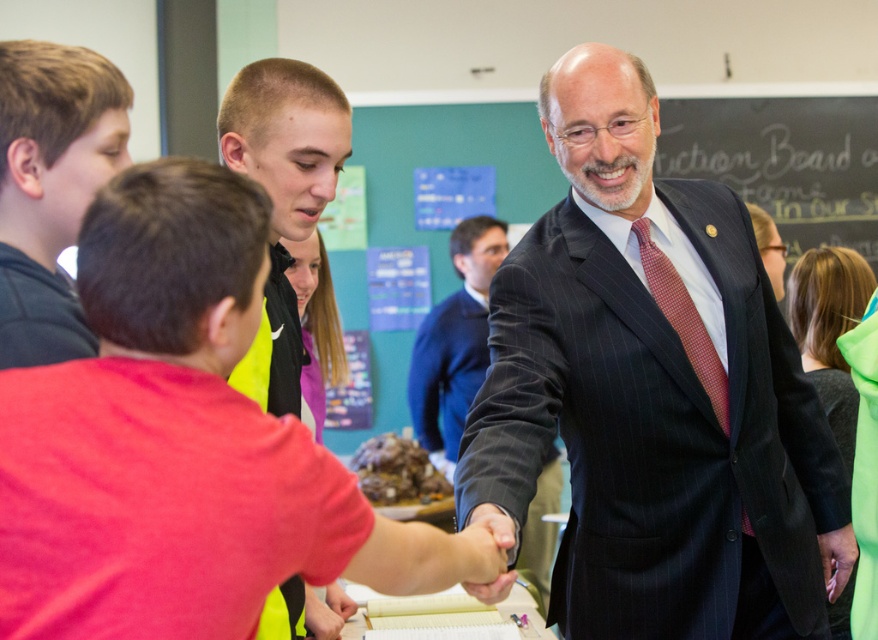
Does point (285, 392) come farther from viewer compared to point (663, 266)?

No.

Between short hair at center and red dotted fabric tie at center, which one appears on the right side from the viewer's perspective?

red dotted fabric tie at center is more to the right.

The height and width of the screenshot is (640, 878). Describe the element at coordinates (283, 198) in the screenshot. I see `short hair at center` at that location.

Where is `short hair at center`? Image resolution: width=878 pixels, height=640 pixels. short hair at center is located at coordinates (283, 198).

Does dark pinstripe suit at center have a larger size compared to chalkboard at upper center?

Yes, dark pinstripe suit at center is bigger than chalkboard at upper center.

Between point (589, 248) and point (707, 118), which one is positioned behind?

Point (707, 118)

Who is more forward, (723, 600) or (804, 177)?

Positioned in front is point (723, 600).

The width and height of the screenshot is (878, 640). Identify the location of dark pinstripe suit at center. (653, 394).

Which is in front, point (573, 80) or point (436, 449)?

Positioned in front is point (573, 80).

Does dark pinstripe suit at center have a lesser height compared to dark blue suit at center?

No, dark pinstripe suit at center is not shorter than dark blue suit at center.

Between point (811, 532) and point (447, 314), which one is positioned in front?

Point (811, 532) is in front.

At what (x,y) coordinates should I click in order to perform the action: click on dark pinstripe suit at center. Please return your answer as a coordinate pair (x, y). This screenshot has width=878, height=640. Looking at the image, I should click on (653, 394).